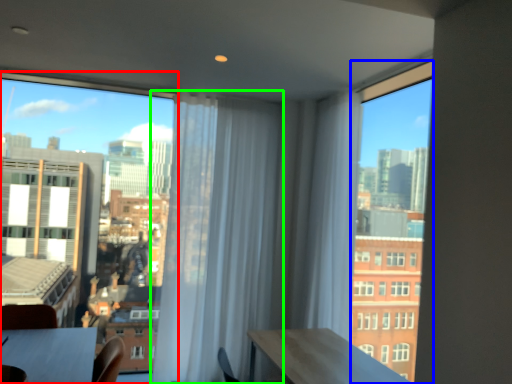
Question: Estimate the real-world distances between objects in this image. Which object is closer to window (highlighted by a red box), window (highlighted by a blue box) or curtain (highlighted by a green box)?

Choices:
 (A) window
 (B) curtain

Answer: (B)